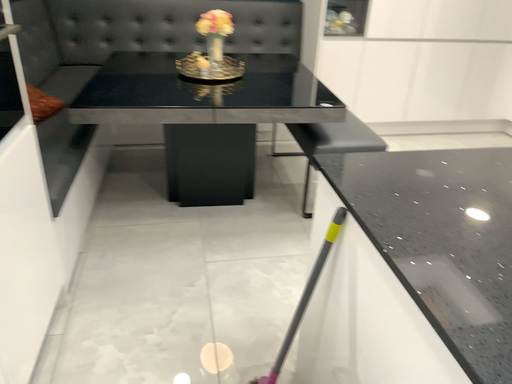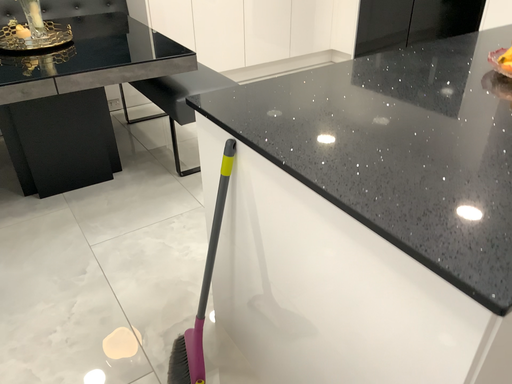
Question: Which way did the camera rotate in the video?

Choices:
 (A) rotated right
 (B) rotated left

Answer: (A)